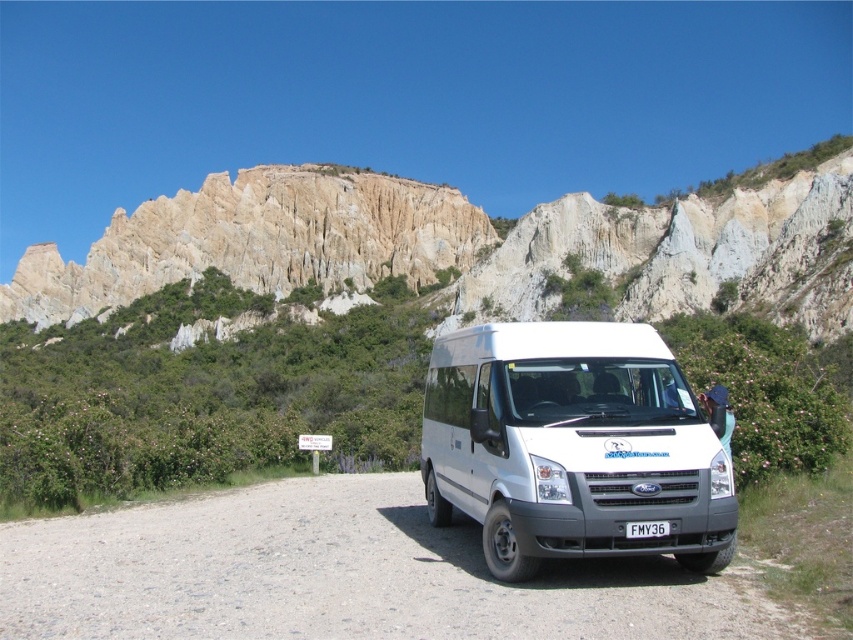
You are standing at the base of the rustic stone cliff at upper center. Looking at the coordinates provided, what direction should you move to reach the white Ford Transit van parked on the gravel road?

The rustic stone cliff at upper center is located at coordinates point (471, 244). Since the van is parked on the gravel road, you should move downward from the cliff to reach it.